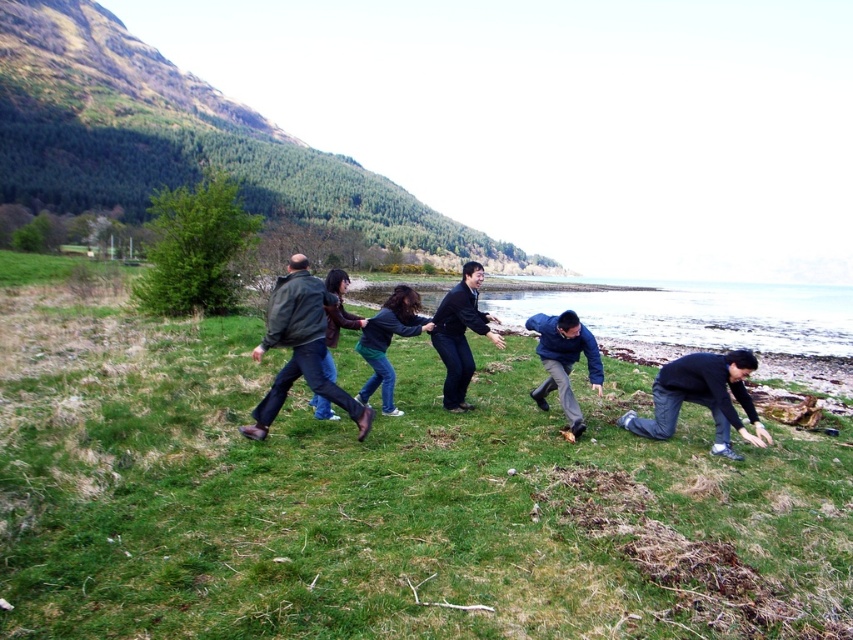
Question: Which point is closer to the camera taking this photo?

Choices:
 (A) (775, 522)
 (B) (386, 342)
 (C) (270, 307)
 (D) (547, 316)

Answer: (A)

Question: Among these objects, which one is farthest from the camera?

Choices:
 (A) dark blue jeans at lower right
 (B) dark blue jeans at center
 (C) green grassy hillside at upper left
 (D) dark blue sweater at center

Answer: (C)

Question: Does dark brown leather jacket at center lie in front of blue denim jeans at center?

Choices:
 (A) no
 (B) yes

Answer: (B)

Question: Can you confirm if dark blue sweater at center is positioned above brown leather jacket at center?

Choices:
 (A) yes
 (B) no

Answer: (B)

Question: Which object is positioned closest to the green grassy hillside at upper left?

Choices:
 (A) dark blue jeans at lower right
 (B) green grassy at center
 (C) dark blue jeans at center
 (D) dark blue sweater at center

Answer: (B)

Question: Where is dark blue jeans at lower right located in relation to brown leather jacket at center in the image?

Choices:
 (A) above
 (B) below

Answer: (B)